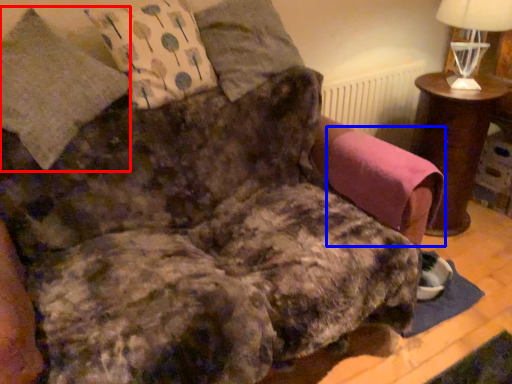
Question: Which of the following is the closest to the observer, pillow (highlighted by a red box) or swivel chair (highlighted by a blue box)?

Choices:
 (A) pillow
 (B) swivel chair

Answer: (A)